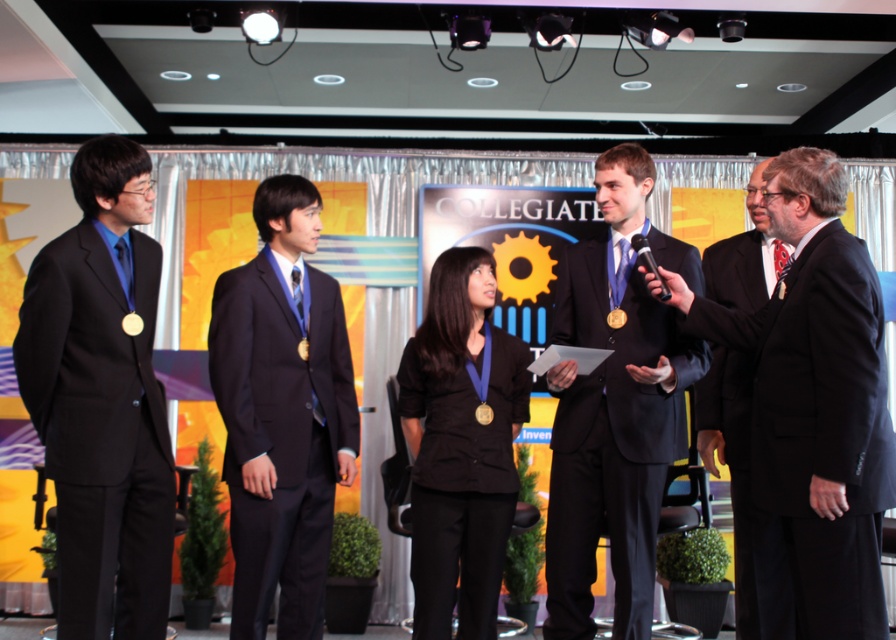
Does matte black suit at left have a lesser height compared to black wool suit at right?

Incorrect, matte black suit at left's height does not fall short of black wool suit at right's.

Is point (76, 561) positioned after point (843, 628)?

Yes, point (76, 561) is farther from viewer.

You are a GUI agent. You are given a task and a screenshot of the screen. Output one action in this format:
    pyautogui.click(x=<x>, y=<y>)
    Task: Click on the matte black suit at left
    
    Given the screenshot: What is the action you would take?
    pyautogui.click(x=102, y=400)

Is point (584, 605) behind point (721, 252)?

No, (584, 605) is closer to viewer.

Image resolution: width=896 pixels, height=640 pixels. I want to click on black matte suit at center, so click(x=610, y=438).

At what (x,y) coordinates should I click in order to perform the action: click on black matte suit at center. Please return your answer as a coordinate pair (x, y). Looking at the image, I should click on (610, 438).

Is black wool suit at right positioned at the back of matte black suit at center?

No, black wool suit at right is in front of matte black suit at center.

Consider the image. How distant is black wool suit at right from matte black suit at center?

black wool suit at right and matte black suit at center are 1.59 meters apart.

The image size is (896, 640). Describe the element at coordinates (810, 444) in the screenshot. I see `black wool suit at right` at that location.

Locate an element on the screen. black wool suit at right is located at coordinates (810, 444).